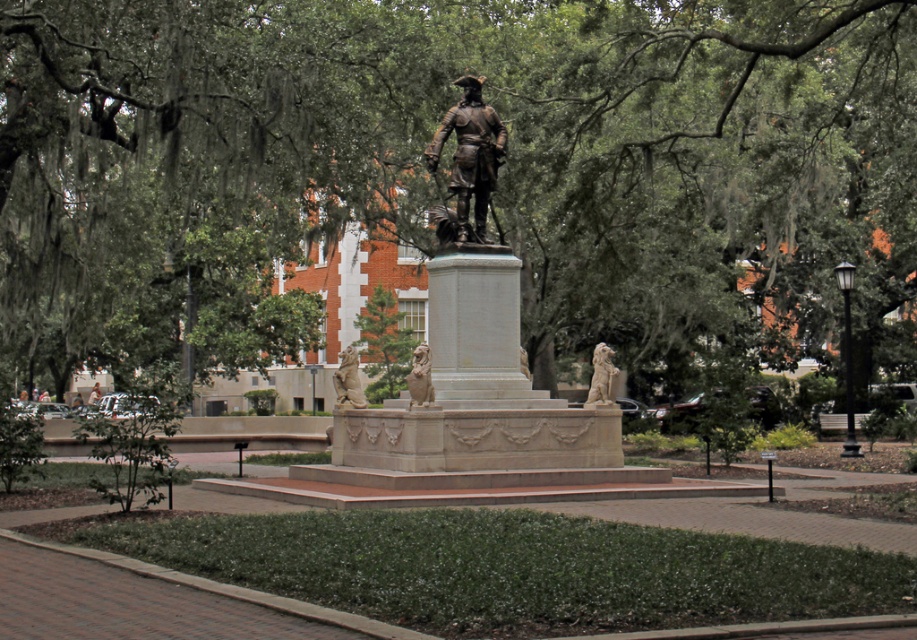
Question: Can you confirm if bronze statue at center is positioned above beige stone lion at center?

Choices:
 (A) no
 (B) yes

Answer: (B)

Question: Which object is farther from the camera taking this photo?

Choices:
 (A) beige stone lion at center
 (B) bronze statue at center

Answer: (B)

Question: Among these objects, which one is nearest to the camera?

Choices:
 (A) green leafy tree at center
 (B) bronze lion at center
 (C) bronze statue at center
 (D) light brown wooden bench at center

Answer: (A)

Question: Is green leafy tree at center positioned behind bronze statue at center?

Choices:
 (A) no
 (B) yes

Answer: (A)

Question: Which is farther from the shiny bronze statue at center?

Choices:
 (A) golden stone lion at center
 (B) beige stone lion at center
 (C) light brown wooden bench at center
 (D) bronze lion at center

Answer: (C)

Question: Can you confirm if bronze statue at center is wider than light brown wooden bench at center?

Choices:
 (A) yes
 (B) no

Answer: (A)